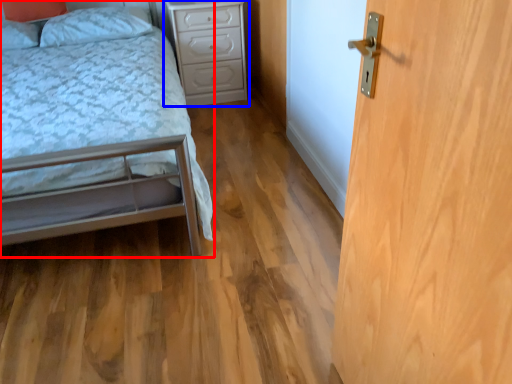
Question: Among these objects, which one is nearest to the camera, bed (highlighted by a red box) or nightstand (highlighted by a blue box)?

Choices:
 (A) bed
 (B) nightstand

Answer: (A)